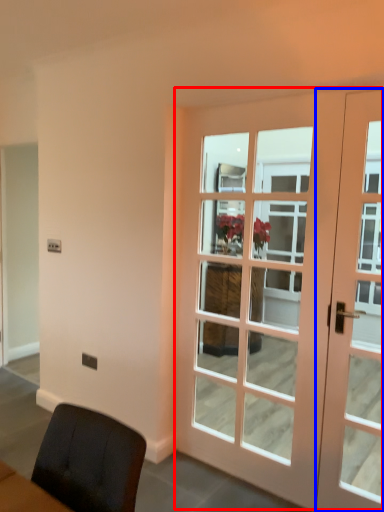
Question: Which object appears farthest to the camera in this image, door (highlighted by a red box) or door (highlighted by a blue box)?

Choices:
 (A) door
 (B) door

Answer: (B)